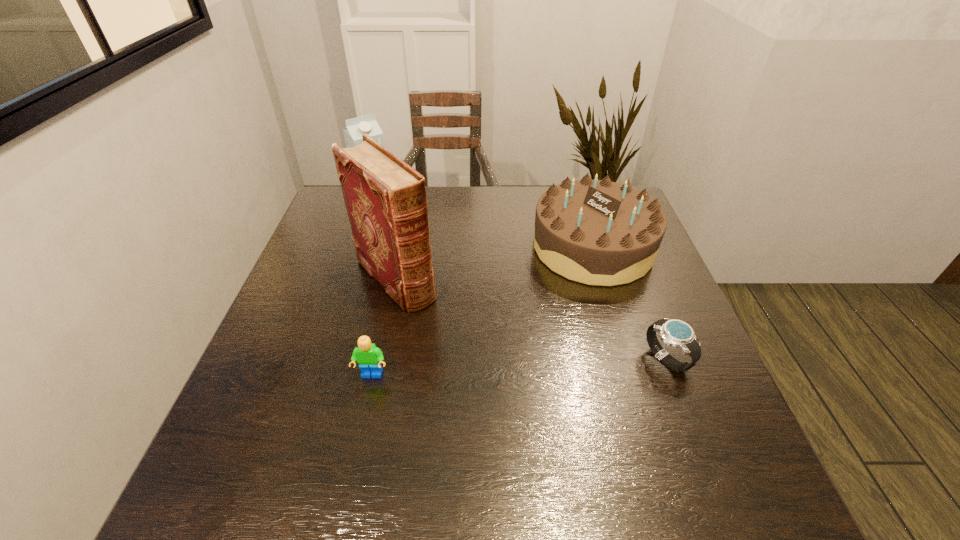
Find the location of a particular element. The height and width of the screenshot is (540, 960). watch that is at the right edge is located at coordinates (676, 333).

The width and height of the screenshot is (960, 540). Identify the location of birthday cake that is at the right edge. (596, 232).

I want to click on object at the far left corner, so click(356, 127).

At what (x,y) coordinates should I click in order to perform the action: click on object present at the far right corner. Please return your answer as a coordinate pair (x, y). This screenshot has height=540, width=960. Looking at the image, I should click on (596, 232).

Find the location of a particular element. The height and width of the screenshot is (540, 960). free spot at the far edge of the desktop is located at coordinates (446, 215).

Find the location of `vacant space at the near edge of the desktop`. vacant space at the near edge of the desktop is located at coordinates (369, 433).

You are a GUI agent. You are given a task and a screenshot of the screen. Output one action in this format:
    pyautogui.click(x=<x>, y=<y>)
    Task: Click on the vacant space at the left edge of the desktop
    This screenshot has height=540, width=960.
    Given the screenshot: What is the action you would take?
    pyautogui.click(x=276, y=363)

Image resolution: width=960 pixels, height=540 pixels. In the image, there is a desktop. What are the coordinates of `vacant area at the right edge` in the screenshot? It's located at (689, 396).

In the image, there is a desktop. At what (x,y) coordinates should I click in order to perform the action: click on free space at the near left corner. Please return your answer as a coordinate pair (x, y). Looking at the image, I should click on 267,437.

In order to click on free location at the near right corner of the desktop in this screenshot , I will do [693, 413].